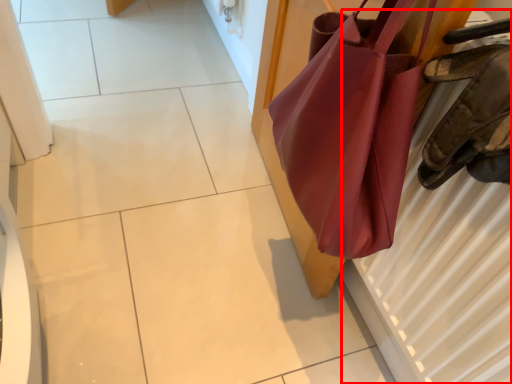
Question: From the image's perspective, where is radiator (annotated by the red box) located in relation to handbag in the image?

Choices:
 (A) above
 (B) below

Answer: (B)